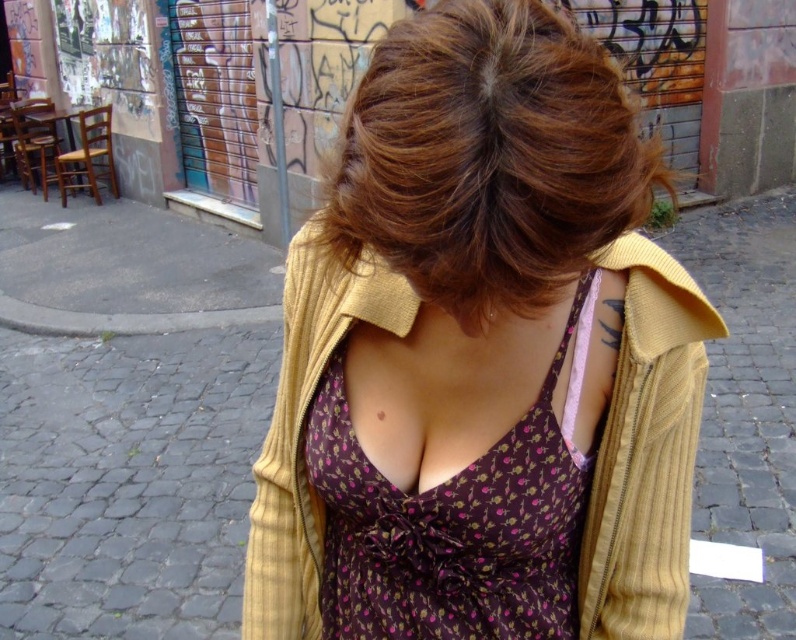
Between brown textured hair at center and purple floral fabric dress at center, which one appears on the left side from the viewer's perspective?

purple floral fabric dress at center

Is the position of brown textured hair at center less distant than that of purple floral fabric dress at center?

Yes.

The width and height of the screenshot is (796, 640). I want to click on brown textured hair at center, so click(x=486, y=157).

Can you confirm if yellow ribbed sweater at center is shorter than brown textured hair at center?

No, yellow ribbed sweater at center is not shorter than brown textured hair at center.

Is yellow ribbed sweater at center smaller than brown textured hair at center?

Incorrect, yellow ribbed sweater at center is not smaller in size than brown textured hair at center.

Does point (422, 200) lie behind point (406, 26)?

That is False.

Where is `yellow ribbed sweater at center`? yellow ribbed sweater at center is located at coordinates (482, 356).

Is point (469, 337) farther from camera compared to point (311, 419)?

That is False.

Is point (412, 442) less distant than point (513, 472)?

No.

This screenshot has height=640, width=796. I want to click on yellow ribbed sweater at center, so click(482, 356).